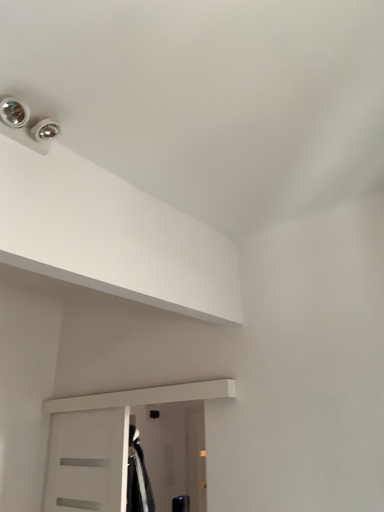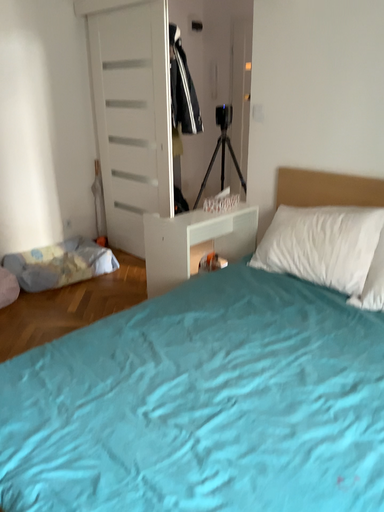
Question: Which way did the camera rotate in the video?

Choices:
 (A) rotated downward
 (B) rotated upward

Answer: (A)